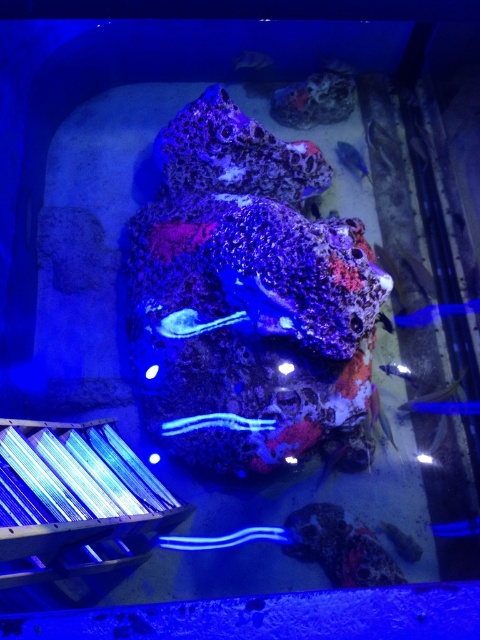
Question: Which object appears closest to the camera in this image?

Choices:
 (A) translucent blue worm at center
 (B) translucent blue fish at upper right

Answer: (A)

Question: Does speckled coral at center appear on the right side of translucent glass fish at center?

Choices:
 (A) no
 (B) yes

Answer: (A)

Question: Among these points, which one is nearest to the camera?

Choices:
 (A) (346, 150)
 (B) (195, 424)

Answer: (B)

Question: Does translucent blue fish at upper right have a lesser width compared to translucent glass fish at center?

Choices:
 (A) yes
 (B) no

Answer: (A)

Question: Considering the real-world distances, which object is farthest from the translucent glass fish at lower right?

Choices:
 (A) speckled coral at center
 (B) translucent blue fish at upper right
 (C) translucent glass fish at center

Answer: (B)

Question: Where is speckled coral at center located in relation to blue glossy fish at right in the image?

Choices:
 (A) left
 (B) right

Answer: (A)